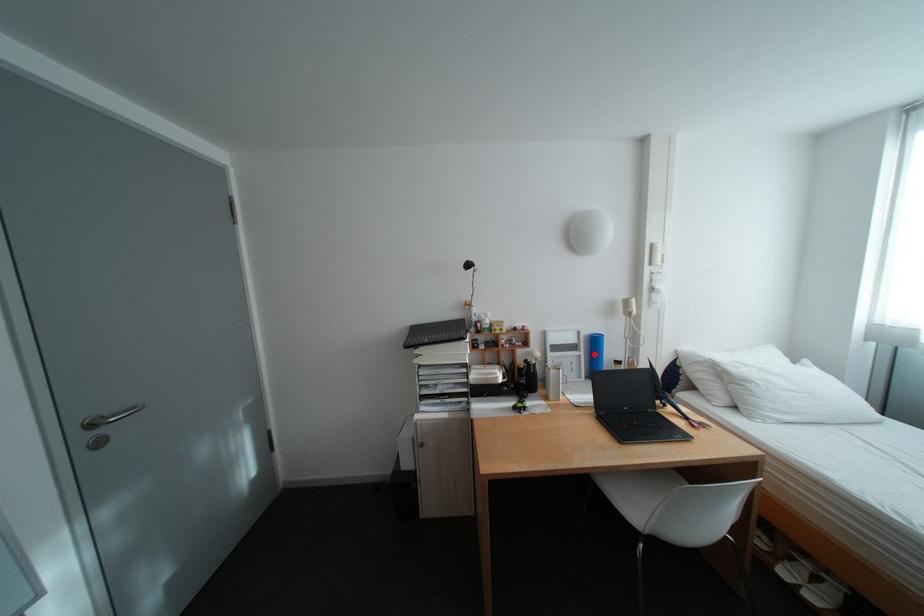
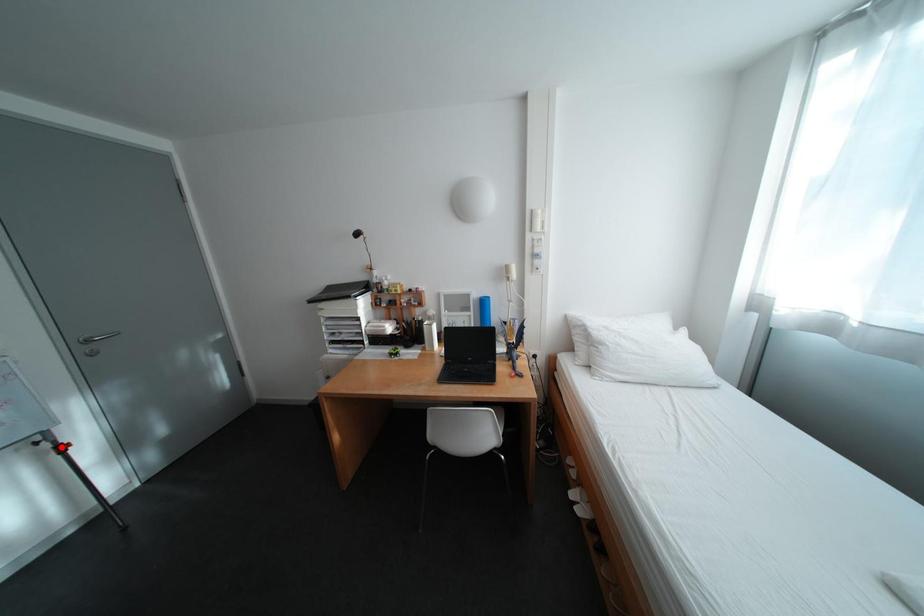
I am providing you with two images of the same scene from different viewpoints. A red point is marked on the first image and another point is marked on the second image. Is the red point in image1 aligned with the point shown in image2?

No